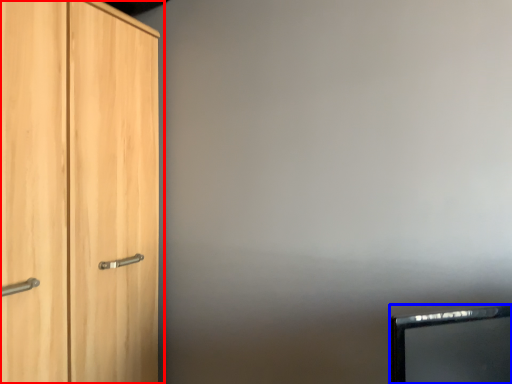
Question: Among these objects, which one is nearest to the camera, cupboard (highlighted by a red box) or computer monitor (highlighted by a blue box)?

Choices:
 (A) cupboard
 (B) computer monitor

Answer: (B)